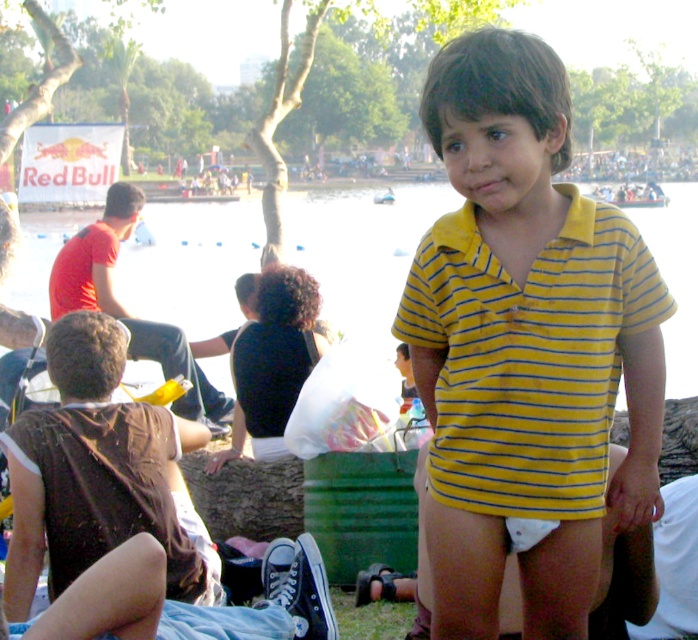
You are a photographer trying to capture the yellow striped shirt at center and the transparent plastic water at center in a single shot. Based on their positions, can you tell which object is closer to the camera?

The yellow striped shirt at center is positioned under transparent plastic water at center, so the transparent plastic water at center is closer to the camera.

You are a photographer trying to capture a clear shot of the yellow striped shirt at center and the transparent plastic water at center. Which object should you focus on first if you want to ensure both are in focus without adjusting the camera settings?

The yellow striped shirt at center is shorter than transparent plastic water at center, so you should focus on the transparent plastic water at center first because it is farther away. This way, the depth of field will cover both objects more effectively.